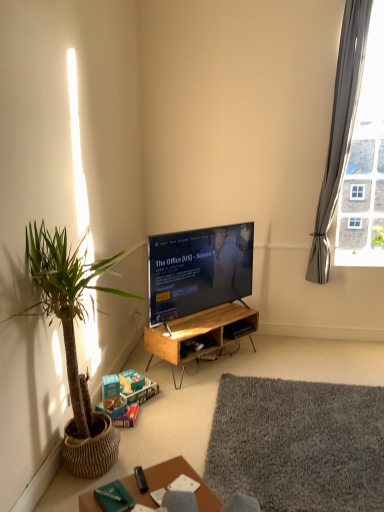
Question: From the image's perspective, does black plastic remote control at lower center appear lower than gray fabric curtain at upper right?

Choices:
 (A) yes
 (B) no

Answer: (A)

Question: Considering the relative sizes of black plastic remote control at lower center and gray fabric curtain at upper right in the image provided, is black plastic remote control at lower center smaller than gray fabric curtain at upper right?

Choices:
 (A) no
 (B) yes

Answer: (B)

Question: Does black plastic remote control at lower center have a greater width compared to gray fabric curtain at upper right?

Choices:
 (A) yes
 (B) no

Answer: (B)

Question: From the image's perspective, does black plastic remote control at lower center appear higher than gray fabric curtain at upper right?

Choices:
 (A) yes
 (B) no

Answer: (B)

Question: Does black plastic remote control at lower center have a larger size compared to gray fabric curtain at upper right?

Choices:
 (A) no
 (B) yes

Answer: (A)

Question: Visually, is woodenmaterial/texturedesk at center positioned to the left or to the right of gray shaggy rug at lower center?

Choices:
 (A) right
 (B) left

Answer: (B)

Question: Is woodenmaterial/texturedesk at center wider or thinner than gray shaggy rug at lower center?

Choices:
 (A) wide
 (B) thin

Answer: (B)

Question: Is woodenmaterial/texturedesk at center inside the boundaries of gray shaggy rug at lower center, or outside?

Choices:
 (A) inside
 (B) outside

Answer: (B)

Question: From their relative heights in the image, would you say woodenmaterial/texturedesk at center is taller or shorter than gray shaggy rug at lower center?

Choices:
 (A) tall
 (B) short

Answer: (A)

Question: Based on their positions, is black plastic remote control at lower center located to the left or right of wooden table at lower center?

Choices:
 (A) right
 (B) left

Answer: (B)

Question: Does point (137, 480) appear closer or farther from the camera than point (145, 494)?

Choices:
 (A) farther
 (B) closer

Answer: (A)

Question: From the image's perspective, is black plastic remote control at lower center above or below wooden table at lower center?

Choices:
 (A) below
 (B) above

Answer: (B)

Question: From a real-world perspective, is black plastic remote control at lower center physically located above or below wooden table at lower center?

Choices:
 (A) above
 (B) below

Answer: (A)

Question: Is matte black tv at center in front of or behind green woven pot at left in the image?

Choices:
 (A) behind
 (B) front

Answer: (A)

Question: From the image's perspective, is matte black tv at center located above or below green woven pot at left?

Choices:
 (A) below
 (B) above

Answer: (B)